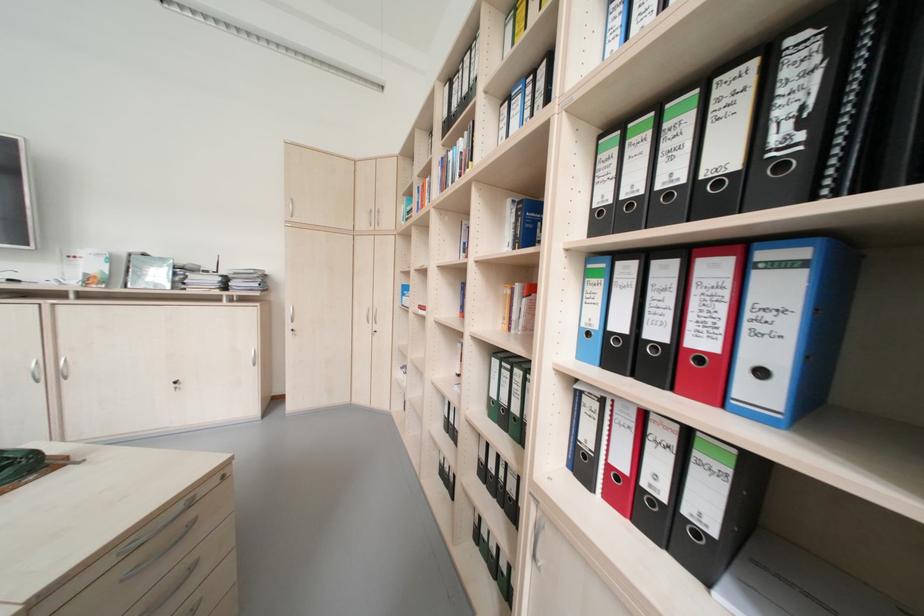
Find where to pull the silver drawer handle. Please return your answer as a coordinate pair (x, y).

(159, 551)